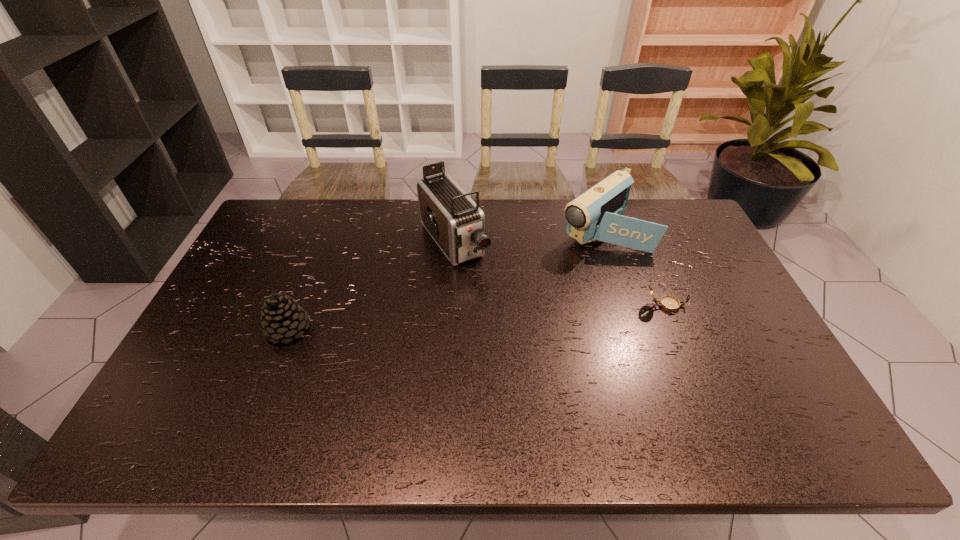
Find the location of a particular element. This screenshot has width=960, height=540. free point between the compass and the third shortest object is located at coordinates (634, 267).

Locate an element on the screen. The height and width of the screenshot is (540, 960). unoccupied area between the leftmost object and the shorter camcorder is located at coordinates (445, 279).

Locate an element on the screen. The height and width of the screenshot is (540, 960). empty space that is in between the right camcorder and the compass is located at coordinates (634, 267).

This screenshot has width=960, height=540. Find the location of `object that is the third nearest to the third shortest object`. object that is the third nearest to the third shortest object is located at coordinates (282, 318).

Identify which object is the nearest to the leftmost object. Please provide its 2D coordinates. Your answer should be formatted as a tuple, i.e. [(x, y)], where the tuple contains the x and y coordinates of a point satisfying the conditions above.

[(456, 223)]

Image resolution: width=960 pixels, height=540 pixels. In order to click on vacant position in the image that satisfies the following two spatial constraints: 1. on the front side of the shortest object; 2. on the face of the taller camcorder in this screenshot , I will do `click(449, 306)`.

This screenshot has width=960, height=540. Identify the location of free space that satisfies the following two spatial constraints: 1. on the back side of the tallest object; 2. on the left side of the shorter camcorder. (455, 229).

Locate an element on the screen. This screenshot has height=540, width=960. vacant space that satisfies the following two spatial constraints: 1. on the front side of the shortest object; 2. on the face of the tallest object is located at coordinates (449, 306).